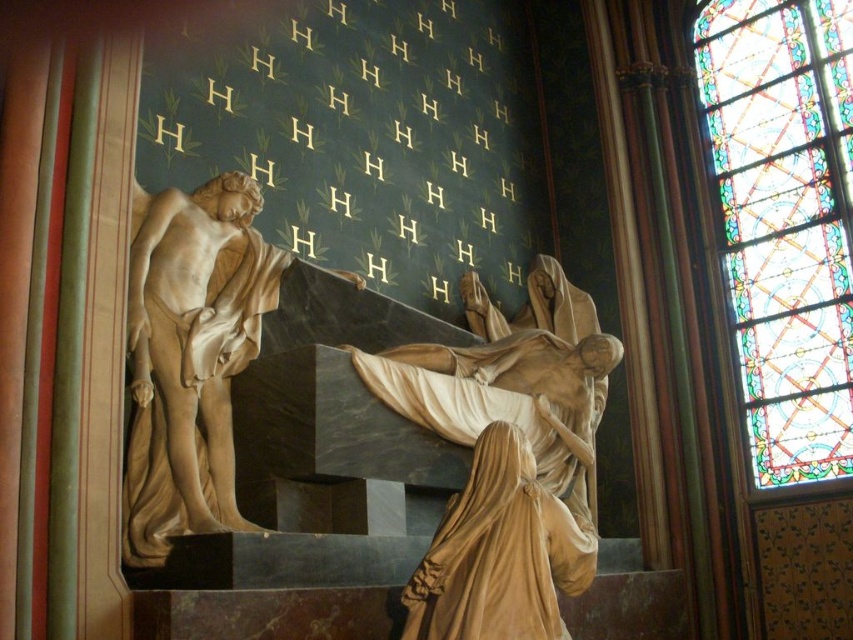
Question: In this image, where is stained glass at upper right located relative to marble statue at center?

Choices:
 (A) left
 (B) right

Answer: (B)

Question: Which object is closer to the camera taking this photo?

Choices:
 (A) stained glass at upper right
 (B) smooth beige cloth at center
 (C) matte gold statue at center
 (D) marble statue at center

Answer: (B)

Question: Can you confirm if stained glass at upper right is wider than marble statue at center?

Choices:
 (A) yes
 (B) no

Answer: (B)

Question: Does stained glass at upper right have a larger size compared to smooth beige cloth at center?

Choices:
 (A) yes
 (B) no

Answer: (A)

Question: Which of the following is the farthest from the observer?

Choices:
 (A) (511, 385)
 (B) (831, 96)
 (C) (178, 476)

Answer: (B)

Question: Which point is closer to the camera?

Choices:
 (A) stained glass at upper right
 (B) matte gold statue at center
 (C) marble statue at center

Answer: (C)